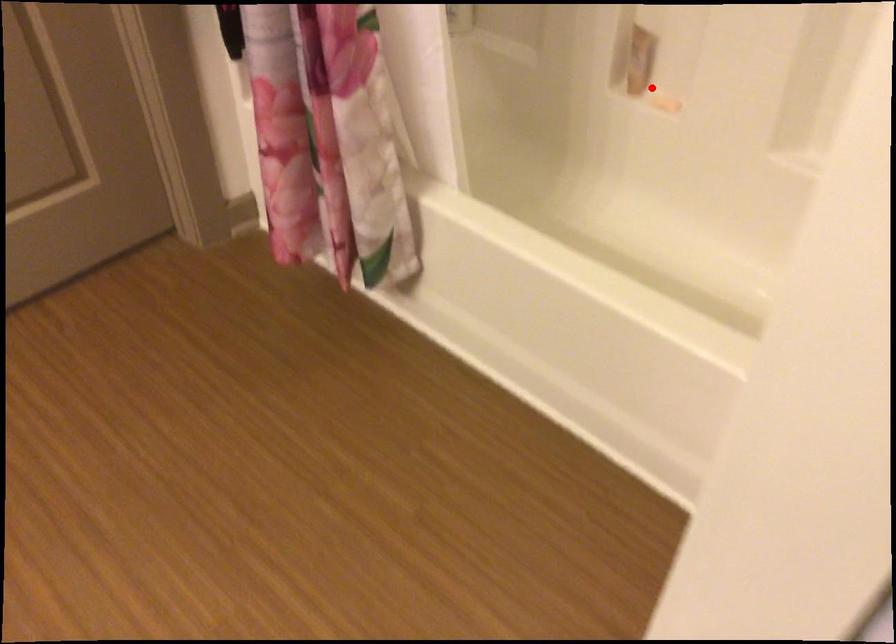
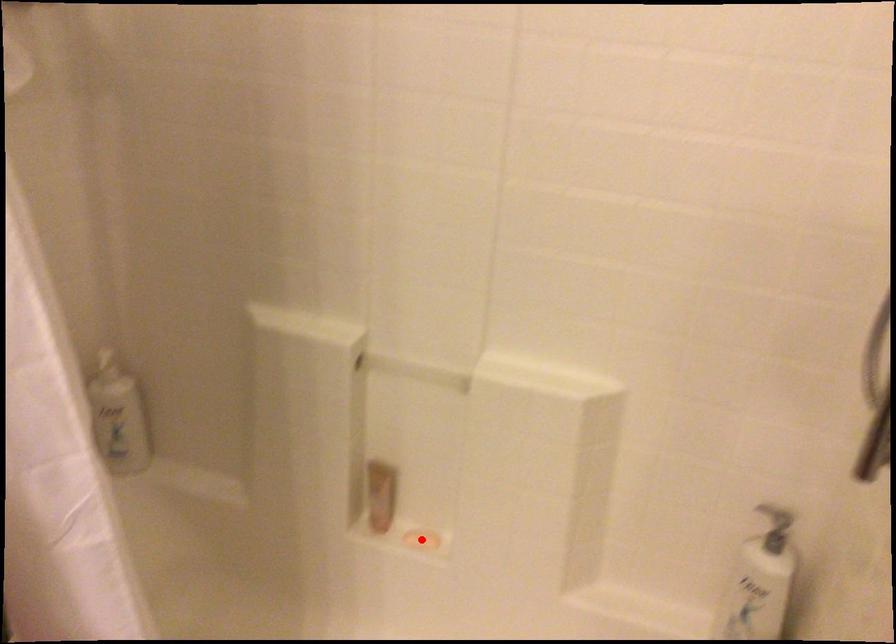
I am providing you with two images of the same scene from different viewpoints. A red point is marked on the first image and another point is marked on the second image. Does the point marked in image1 correspond to the same location as the one in image2?

Yes